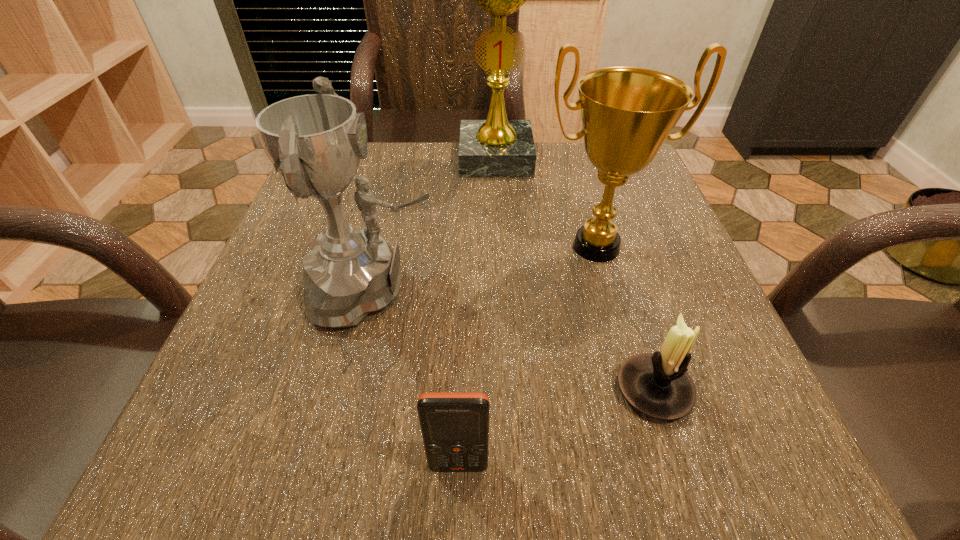
Find the location of `the farthest award`. the farthest award is located at coordinates (496, 147).

You are a GUI agent. You are given a task and a screenshot of the screen. Output one action in this format:
    pyautogui.click(x=<x>, y=<y>)
    Task: Click on the leftmost object
    
    Given the screenshot: What is the action you would take?
    pyautogui.click(x=316, y=141)

In order to click on candle holder in this screenshot , I will do `click(657, 385)`.

The width and height of the screenshot is (960, 540). I want to click on the nearest object, so click(x=455, y=426).

You are a GUI agent. You are given a task and a screenshot of the screen. Output one action in this format:
    pyautogui.click(x=<x>, y=<y>)
    Task: Click on the vacant space located 0.130m on the front-facing side of the farthest object
    The image size is (960, 540).
    Given the screenshot: What is the action you would take?
    pyautogui.click(x=498, y=212)

You are a GUI agent. You are given a task and a screenshot of the screen. Output one action in this format:
    pyautogui.click(x=<x>, y=<y>)
    Task: Click on the vacant space located 0.150m on the side with emblem of the leftmost object
    The width and height of the screenshot is (960, 540).
    Given the screenshot: What is the action you would take?
    pyautogui.click(x=530, y=289)

Locate an element on the screen. Image resolution: width=960 pixels, height=540 pixels. vacant space located 0.220m on the left of the second nearest object is located at coordinates [x=458, y=390].

Find the location of `object that is positioned at the far edge`. object that is positioned at the far edge is located at coordinates (496, 147).

This screenshot has height=540, width=960. I want to click on candle holder positioned at the near edge, so click(x=657, y=385).

The width and height of the screenshot is (960, 540). I want to click on cellular telephone present at the near edge, so click(455, 426).